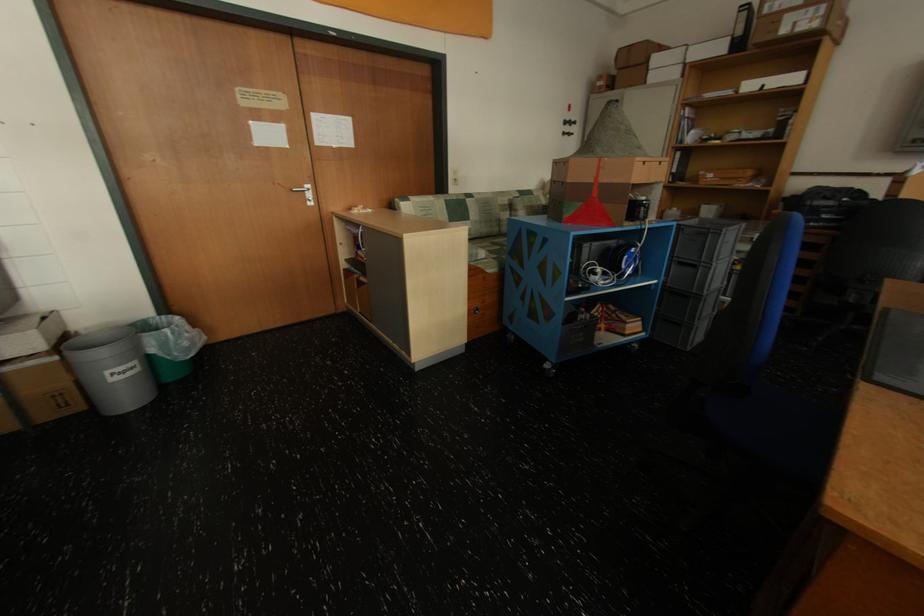
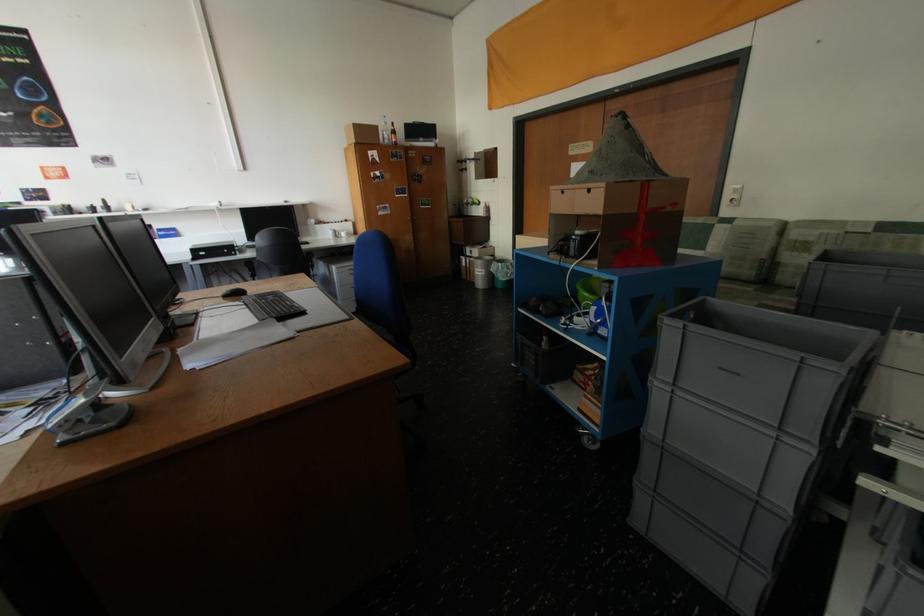
The point at (669,164) is marked in the first image. Where is the corresponding point in the second image?

(598, 192)